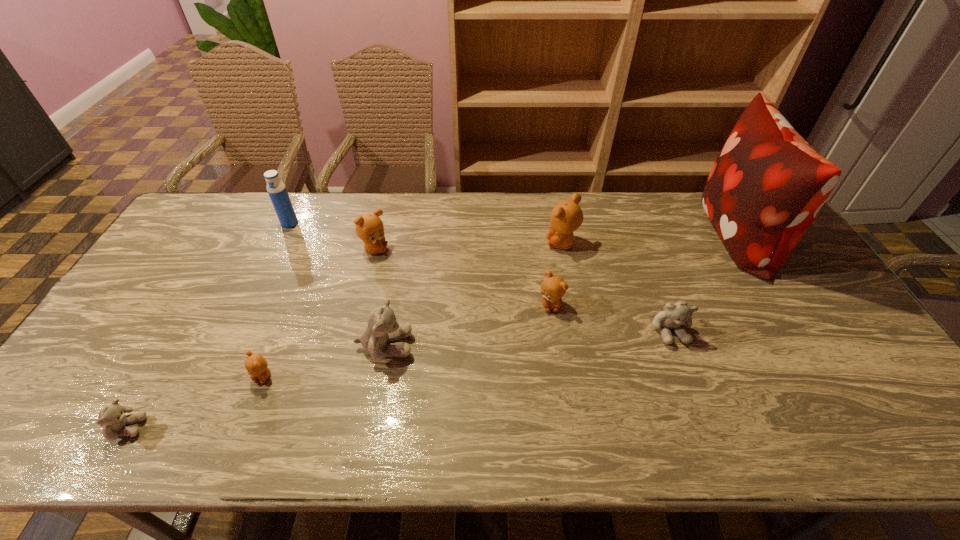
Find the location of a particular element. Image resolution: width=960 pixels, height=540 pixels. vacant space at the near left corner of the desktop is located at coordinates (59, 450).

Image resolution: width=960 pixels, height=540 pixels. I want to click on vacant area between the eighth object from right to left and the second nearest brown teddy bear, so click(x=420, y=264).

Locate an element on the screen. Image resolution: width=960 pixels, height=540 pixels. free spot between the second gray teddy bear from left to right and the second smallest brown teddy bear is located at coordinates coord(468,326).

This screenshot has width=960, height=540. What are the coordinates of `empty space between the eighth object from left to right and the nearest object` in the screenshot? It's located at (397, 379).

Image resolution: width=960 pixels, height=540 pixels. I want to click on empty space that is in between the second object from right to left and the smallest gray teddy bear, so click(397, 379).

I want to click on free space between the second gray teddy bear from left to right and the leftmost object, so click(x=255, y=387).

The image size is (960, 540). I want to click on free space between the smallest brown teddy bear and the nearest teddy bear, so click(x=195, y=402).

Identify the location of vacant area between the biggest brown teddy bear and the second biggest brown teddy bear. (468, 247).

The height and width of the screenshot is (540, 960). What are the coordinates of `blank region between the second nearest brown teddy bear and the nearest brown teddy bear` in the screenshot? It's located at (407, 340).

This screenshot has width=960, height=540. Find the location of `vacant point located between the nearest brown teddy bear and the blue water bottle`. vacant point located between the nearest brown teddy bear and the blue water bottle is located at coordinates (276, 300).